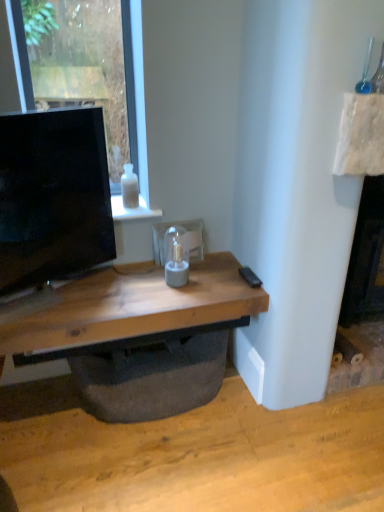
Locate an element on the screen. The image size is (384, 512). free space to the back side of black plastic remote at lower right is located at coordinates (225, 262).